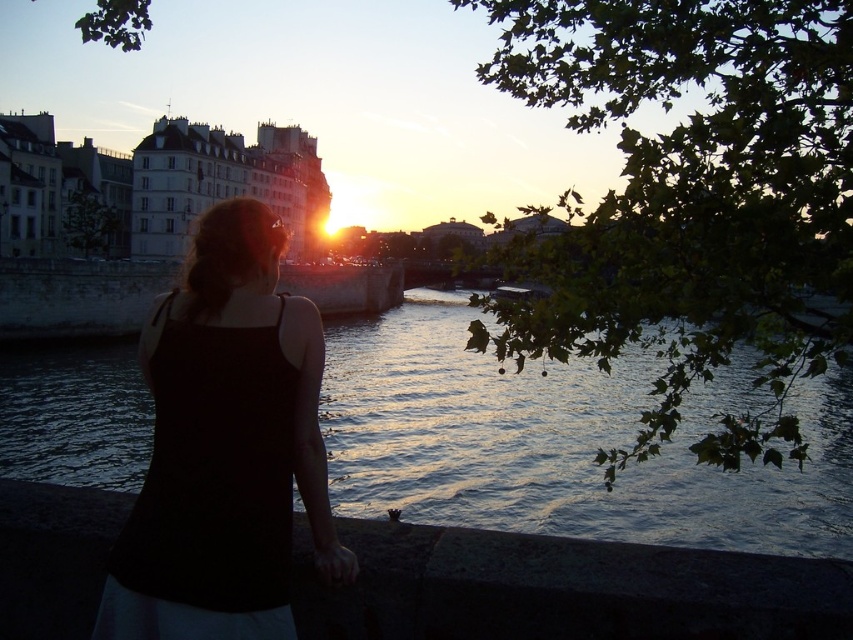
You are a photographer trying to capture the sunset reflection on the water. You notice the dark blue water at center and the black fabric dress at center. Which object is positioned higher in the image?

The dark blue water at center is located above the black fabric dress at center, so it is positioned higher in the image.

Based on the coordinates provided, which object in the scene is located at point [564,442]?

The point [564,442] marks the dark blue water at center.

You are standing at the riverside and want to cross the river to the other side. The dark blue water at center is flowing gently. If you can swim 1.2 meters per second, how long will it take you to swim across the river?

The distance between you and the dark blue water at center is 89.52 meters. To swim across, you would need to cover this distance. At a speed of 1.2 meters per second, the time required would be 89.52 divided by 1.2, which equals approximately 74.6 seconds, or roughly 1 minute and 15 seconds.